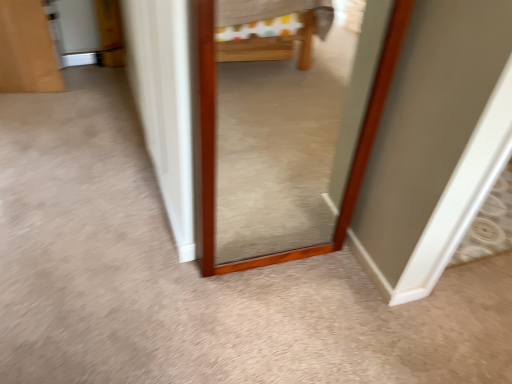
Find the location of `vacant space behind wooden frame mirror at center`. vacant space behind wooden frame mirror at center is located at coordinates (278, 231).